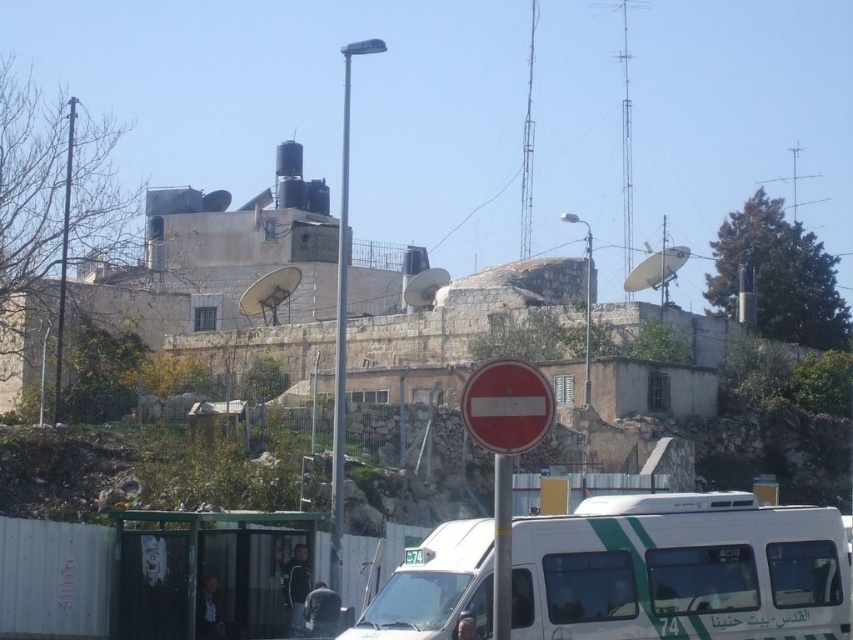
You are a delivery driver who needs to park your vehicle between the white glossy van at center and the red matte sign at center. Given that your vehicle is 4 meters long, can you fit it in the available space between them?

The white glossy van at center is larger in size than the red matte sign at center. However, without specific distance information between them, it is impossible to determine if the 4 meter vehicle can fit. Please check the actual spacing between the white glossy van at center and the red matte sign at center.

You are a delivery driver who needs to park your white glossy van at center in a specific spot marked at coordinates 0.891, 0.798. According to the image, is the van already parked correctly?

Yes, the white glossy van at center is already parked correctly at the coordinates (680, 570) as specified.